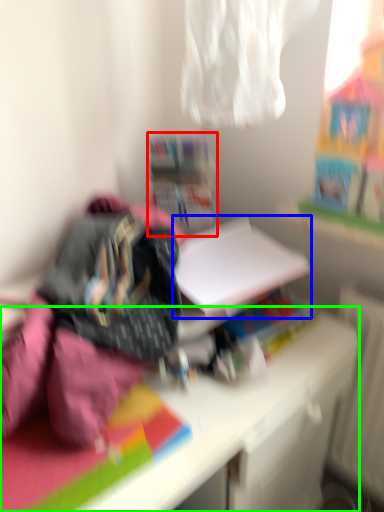
Question: Which object is the closest to the shelf (highlighted by a red box)? Choose among these: paperback book (highlighted by a blue box) or desk (highlighted by a green box).

Choices:
 (A) paperback book
 (B) desk

Answer: (A)